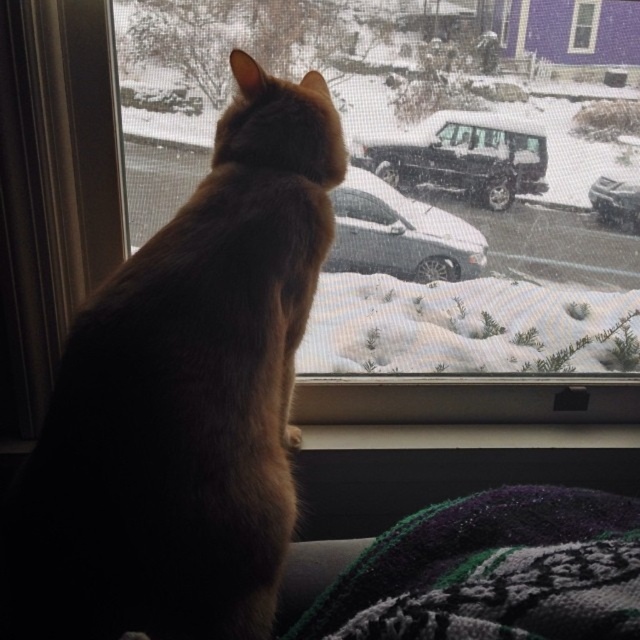
You are a delivery person trying to reach the black matte truck at center. There is a brown furry cat at center blocking your path. Can you walk around the cat to get to the truck?

The brown furry cat at center is in front of the black matte truck at center, so you can walk around the cat to reach the truck since the cat is blocking the direct path but not the entire area.

What are the coordinates of the brown furry cat at center in the image?

The coordinates of the brown furry cat at center are at point (184, 397).